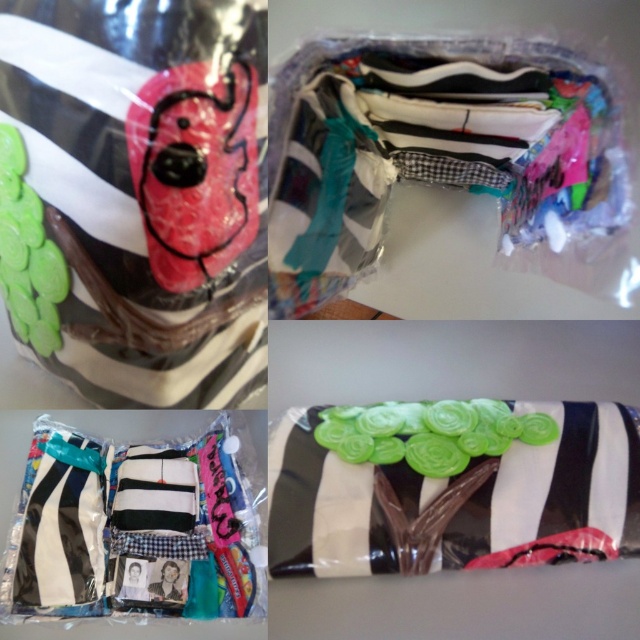
Question: Which object is the closest to the green matte fabric at center?

Choices:
 (A) matte black fabric at center
 (B) matte plastic bag at center

Answer: (B)

Question: Can you confirm if matte plastic chocolate cake at upper left is wider than matte plastic bag at center?

Choices:
 (A) no
 (B) yes

Answer: (A)

Question: Which object appears farthest from the camera in this image?

Choices:
 (A) green matte fabric at center
 (B) matte plastic chocolate cake at upper left
 (C) matte plastic bag at center
 (D) matte black fabric at center

Answer: (D)

Question: Can you confirm if matte plastic bag at center is bigger than green matte fabric at center?

Choices:
 (A) yes
 (B) no

Answer: (A)

Question: Is matte plastic chocolate cake at upper left bigger than green matte fabric at center?

Choices:
 (A) yes
 (B) no

Answer: (A)

Question: Which point is closer to the camera taking this photo?

Choices:
 (A) (150, 125)
 (B) (592, 72)

Answer: (A)